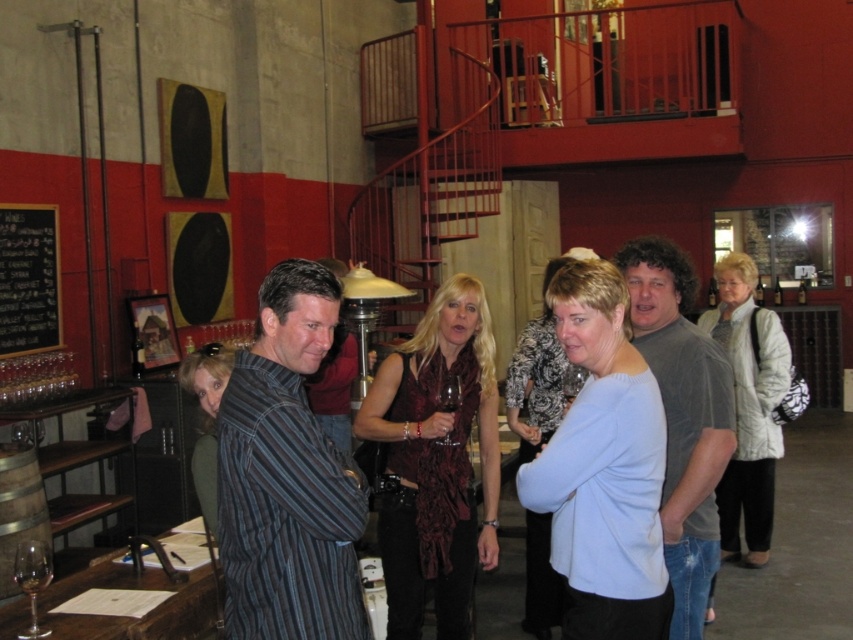
You are at a winery event and want to write a message on the black chalkboard at left. However, there is a transparent glass at center in between you and the chalkboard. Can you reach the chalkboard without touching the glass?

The black chalkboard at left is positioned on the left side of the transparent glass at center, meaning it is to the side of the glass. Therefore, you can reach the chalkboard without touching the glass by moving around to its left side.